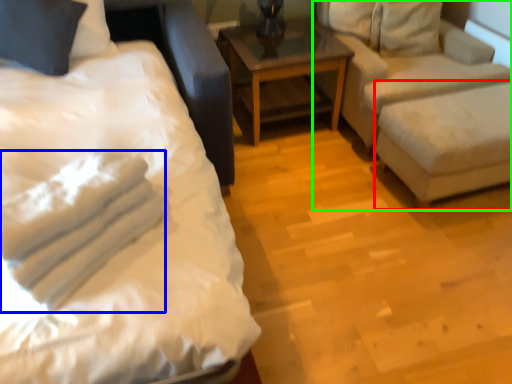
Question: Which object is the closest to the swivel chair (highlighted by a red box)? Choose among these: material (highlighted by a blue box) or studio couch (highlighted by a green box).

Choices:
 (A) material
 (B) studio couch

Answer: (B)